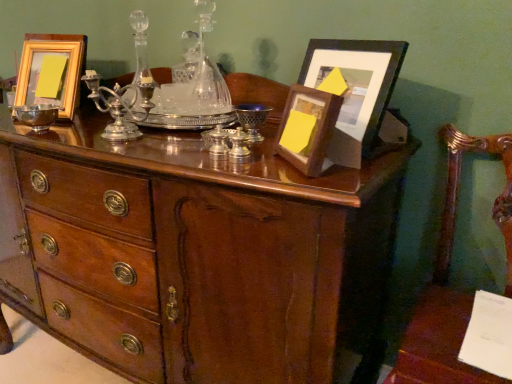
Question: Do you think wooden armchair at right is within shiny silver candle holder at center, the first candle holder viewed from the front, or outside of it?

Choices:
 (A) outside
 (B) inside

Answer: (A)

Question: From the image's perspective, is wooden armchair at right positioned above or below shiny silver candle holder at center, which is counted as the 1th candle holder, starting from the right?

Choices:
 (A) below
 (B) above

Answer: (A)

Question: Which of these objects is positioned closest to the white paper at lower right?

Choices:
 (A) shiny silver bowl at left
 (B) shiny silver candle holder at center, the first candle holder viewed from the front
 (C) silver metallic candle holder at center, the second candle holder viewed from the left
 (D) gold wooden picture frame at upper left, which appears as the 1th picture frame when viewed from the left
 (E) wooden armchair at right

Answer: (E)

Question: Which of these objects is positioned closest to the shiny silver bowl at left?

Choices:
 (A) shiny silver candle holder at center, the first candle holder viewed from the front
 (B) mahogany wood chest of drawers at center
 (C) silver polished candle holder at center, the 3th candle holder positioned from the front
 (D) gold wooden picture frame at upper left, which appears as the 1th picture frame when viewed from the left
 (E) wooden picture frame at upper right, which is the 2th picture frame from right to left

Answer: (D)